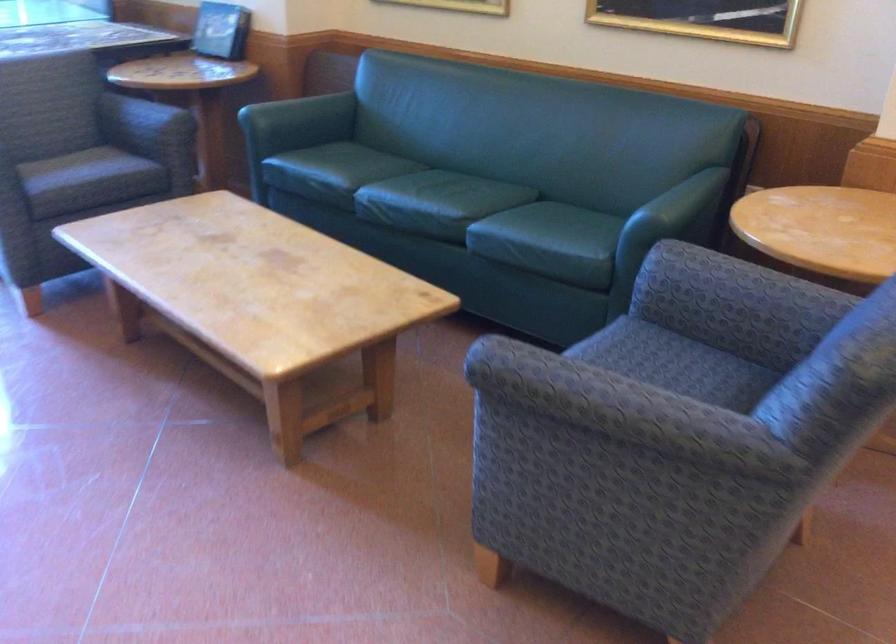
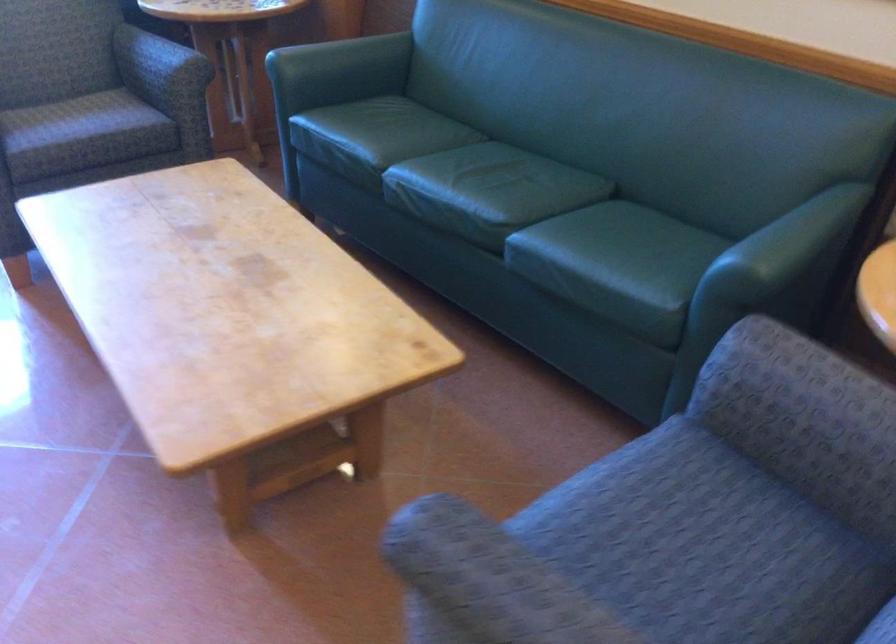
Question: I am providing you with two images of the same scene from different viewpoints. Please identify which objects are invisible in image2.

Choices:
 (A) patterned chair armrest
 (B) green sofa armrest
 (C) green sofa sitting surface
 (D) none of these

Answer: (D)